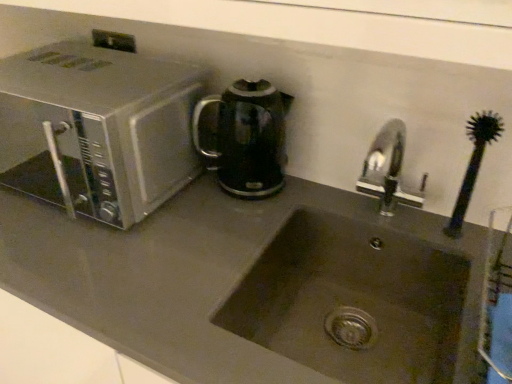
Question: Choose the correct answer: Is silver metallic microwave at left inside slate gray stone sink at center or outside it?

Choices:
 (A) inside
 (B) outside

Answer: (B)

Question: Considering their positions, is silver metallic microwave at left located in front of or behind slate gray stone sink at center?

Choices:
 (A) front
 (B) behind

Answer: (B)

Question: Based on their relative distances, which object is farther from the matte stainless steel sink at center?

Choices:
 (A) slate gray stone sink at center
 (B) silver metallic microwave at left
 (C) metallic stainless steel at upper left
 (D) black glossy electric kettle at center

Answer: (C)

Question: Based on their relative distances, which object is nearer to the slate gray stone sink at center?

Choices:
 (A) metallic stainless steel at upper left
 (B) black glossy electric kettle at center
 (C) silver metallic microwave at left
 (D) matte stainless steel sink at center

Answer: (D)